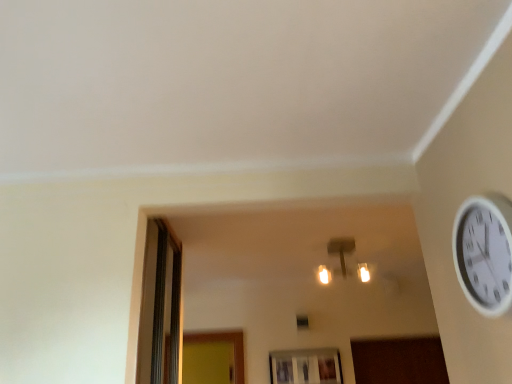
Question: Is transparent glass window at lower center with white plastic wall clock at upper right?

Choices:
 (A) no
 (B) yes

Answer: (A)

Question: From a real-world perspective, is transparent glass window at lower center over white plastic wall clock at upper right?

Choices:
 (A) yes
 (B) no

Answer: (B)

Question: Can you confirm if transparent glass window at lower center is bigger than white plastic wall clock at upper right?

Choices:
 (A) no
 (B) yes

Answer: (A)

Question: Does transparent glass window at lower center have a lesser width compared to white plastic wall clock at upper right?

Choices:
 (A) no
 (B) yes

Answer: (B)

Question: Is transparent glass window at lower center shorter than white plastic wall clock at upper right?

Choices:
 (A) yes
 (B) no

Answer: (A)

Question: Looking at their shapes, would you say matte gold light fixture at center is wider or thinner than transparent glass window at lower center?

Choices:
 (A) wide
 (B) thin

Answer: (A)

Question: Based on their positions, is matte gold light fixture at center located to the left or right of transparent glass window at lower center?

Choices:
 (A) right
 (B) left

Answer: (A)

Question: From a real-world perspective, is matte gold light fixture at center above or below transparent glass window at lower center?

Choices:
 (A) above
 (B) below

Answer: (A)

Question: From the image's perspective, is matte gold light fixture at center positioned above or below transparent glass window at lower center?

Choices:
 (A) above
 (B) below

Answer: (A)

Question: In terms of width, does matte gold light fixture at center look wider or thinner when compared to white plastic wall clock at upper right?

Choices:
 (A) wide
 (B) thin

Answer: (A)

Question: Based on their positions, is matte gold light fixture at center located to the left or right of white plastic wall clock at upper right?

Choices:
 (A) right
 (B) left

Answer: (B)

Question: Is matte gold light fixture at center spatially inside white plastic wall clock at upper right, or outside of it?

Choices:
 (A) outside
 (B) inside

Answer: (A)

Question: Relative to white plastic wall clock at upper right, is matte gold light fixture at center in front or behind?

Choices:
 (A) behind
 (B) front

Answer: (A)

Question: In terms of height, does white plastic wall clock at upper right look taller or shorter compared to transparent glass window at lower center?

Choices:
 (A) tall
 (B) short

Answer: (A)

Question: From a real-world perspective, is white plastic wall clock at upper right physically located above or below transparent glass window at lower center?

Choices:
 (A) below
 (B) above

Answer: (B)